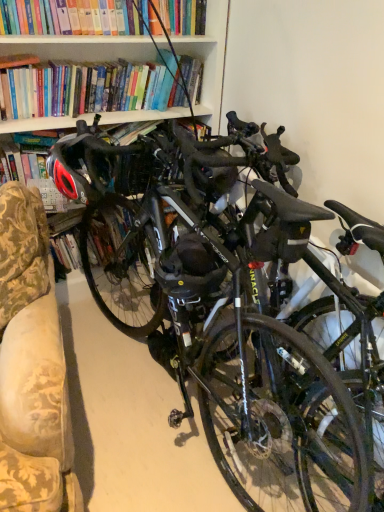
Question: Is shiny black helmet at left taller than shiny black bicycle at center?

Choices:
 (A) no
 (B) yes

Answer: (A)

Question: Is shiny black helmet at left shorter than shiny black bicycle at center?

Choices:
 (A) yes
 (B) no

Answer: (A)

Question: Can you confirm if shiny black helmet at left is wider than shiny black bicycle at center?

Choices:
 (A) no
 (B) yes

Answer: (A)

Question: From a real-world perspective, is shiny black helmet at left below shiny black bicycle at center?

Choices:
 (A) no
 (B) yes

Answer: (A)

Question: Does shiny black helmet at left come in front of shiny black bicycle at center?

Choices:
 (A) yes
 (B) no

Answer: (B)

Question: In terms of width, does shiny black helmet at left look wider or thinner when compared to shiny black bicycle at center?

Choices:
 (A) thin
 (B) wide

Answer: (A)

Question: From a real-world perspective, is shiny black helmet at left positioned above or below shiny black bicycle at center?

Choices:
 (A) below
 (B) above

Answer: (B)

Question: Considering the positions of shiny black helmet at left and shiny black bicycle at center in the image, is shiny black helmet at left taller or shorter than shiny black bicycle at center?

Choices:
 (A) short
 (B) tall

Answer: (A)

Question: Is shiny black helmet at left situated inside shiny black bicycle at center or outside?

Choices:
 (A) inside
 (B) outside

Answer: (A)

Question: Is matte black helmet at center in front of or behind shiny black helmet at left in the image?

Choices:
 (A) behind
 (B) front

Answer: (A)

Question: Do you think matte black helmet at center is within shiny black helmet at left, or outside of it?

Choices:
 (A) inside
 (B) outside

Answer: (B)

Question: From the image's perspective, is matte black helmet at center above or below shiny black helmet at left?

Choices:
 (A) above
 (B) below

Answer: (B)

Question: From their relative heights in the image, would you say matte black helmet at center is taller or shorter than shiny black helmet at left?

Choices:
 (A) tall
 (B) short

Answer: (B)

Question: Do you think matte black helmet at center is within shiny black bicycle at center, or outside of it?

Choices:
 (A) outside
 (B) inside

Answer: (B)

Question: Looking at the image, does matte black helmet at center seem bigger or smaller compared to shiny black bicycle at center?

Choices:
 (A) big
 (B) small

Answer: (B)